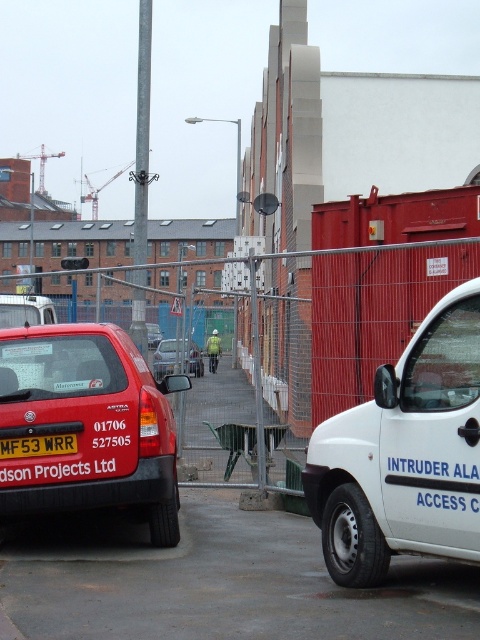
Question: Is white matte van at right bigger than matte red car at center?

Choices:
 (A) yes
 (B) no

Answer: (A)

Question: Which is farther from the metal mesh fence at center?

Choices:
 (A) matte red van at center-left
 (B) matte red car at center

Answer: (B)

Question: Which of the following is the farthest from the observer?

Choices:
 (A) (10, 410)
 (B) (425, 387)

Answer: (A)

Question: In this image, where is metal mesh fence at center located relative to matte red car at center?

Choices:
 (A) left
 (B) right

Answer: (A)

Question: In this image, where is white matte van at right located relative to yellow matte license plate at center?

Choices:
 (A) above
 (B) below

Answer: (A)

Question: Among these objects, which one is nearest to the camera?

Choices:
 (A) yellow matte license plate at center
 (B) matte red van at center-left

Answer: (B)